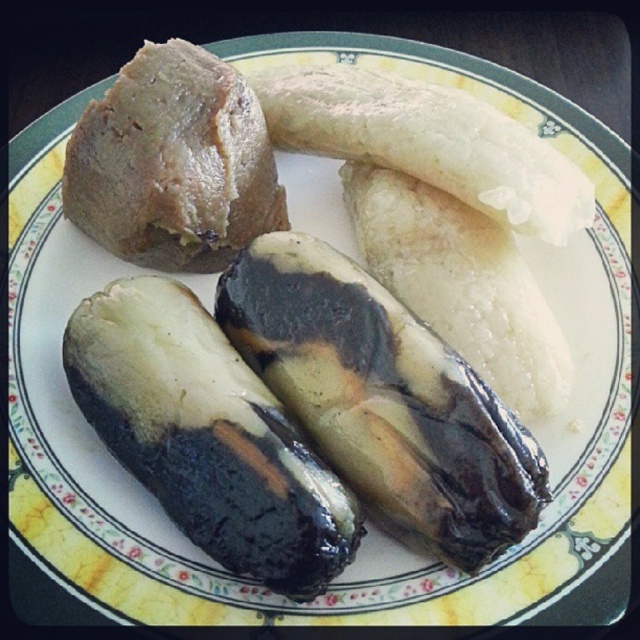
Is charcoal-black eggplant at center closer to camera compared to white creamy banana at upper right?

Yes.

Between charcoal-black eggplant at center and white creamy banana at upper right, which one is positioned higher?

white creamy banana at upper right

Which is behind, point (218, 394) or point (536, 147)?

Positioned behind is point (536, 147).

This screenshot has height=640, width=640. I want to click on charcoal-black eggplant at center, so click(x=208, y=436).

Does matte brown rice cake at upper left appear on the left side of white creamy banana at upper right?

Correct, you'll find matte brown rice cake at upper left to the left of white creamy banana at upper right.

Between point (188, 176) and point (548, 163), which one is positioned behind?

Point (188, 176)

Between point (225, 236) and point (516, 173), which one is positioned behind?

Point (225, 236)

Locate an element on the screen. matte brown rice cake at upper left is located at coordinates pyautogui.click(x=173, y=163).

Which is more to the right, matte brown rice cake at upper left or white matte banana at upper center?

white matte banana at upper center

Can you confirm if matte brown rice cake at upper left is shorter than white matte banana at upper center?

Indeed, matte brown rice cake at upper left has a lesser height compared to white matte banana at upper center.

The image size is (640, 640). What do you see at coordinates (173, 163) in the screenshot?
I see `matte brown rice cake at upper left` at bounding box center [173, 163].

The height and width of the screenshot is (640, 640). In order to click on matte brown rice cake at upper left in this screenshot , I will do `click(173, 163)`.